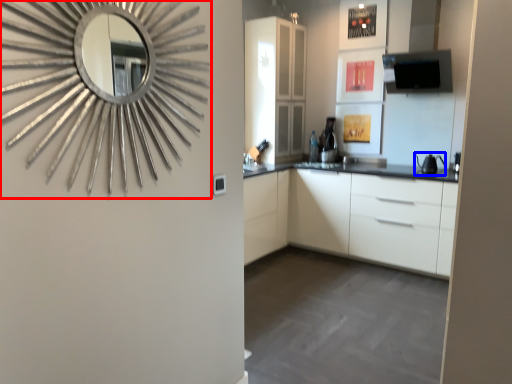
Question: Which object is further to the camera taking this photo, mirror (highlighted by a red box) or appliance (highlighted by a blue box)?

Choices:
 (A) mirror
 (B) appliance

Answer: (B)